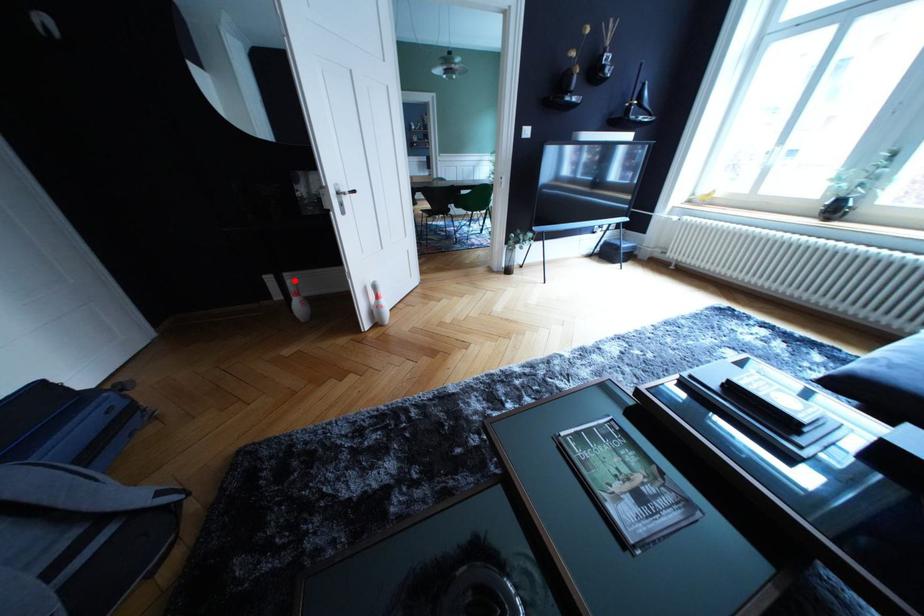
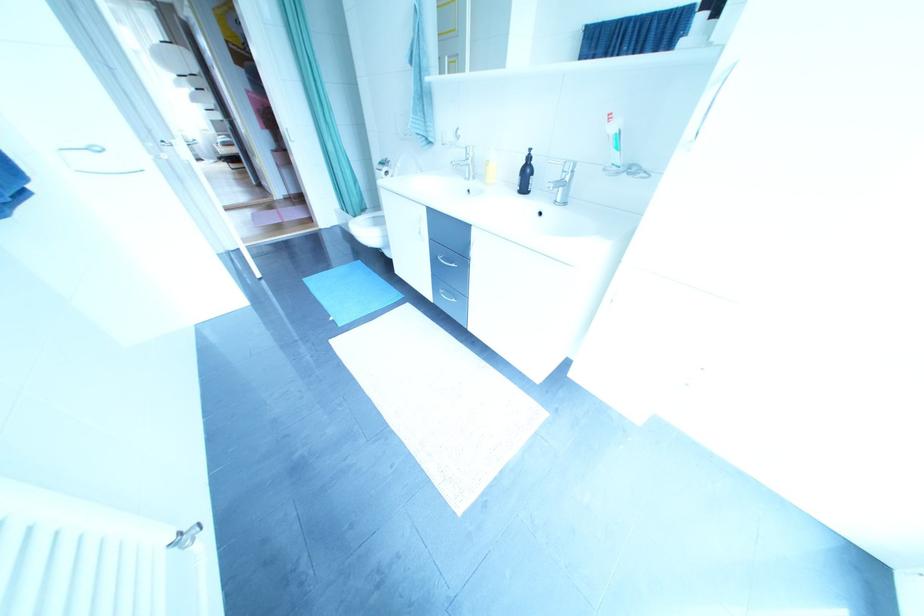
Question: I am providing you with two images of the same scene from different viewpoints. A red point is marked on the first image. Is the red point's position out of view in image 2?

Choices:
 (A) Yes
 (B) No

Answer: (A)